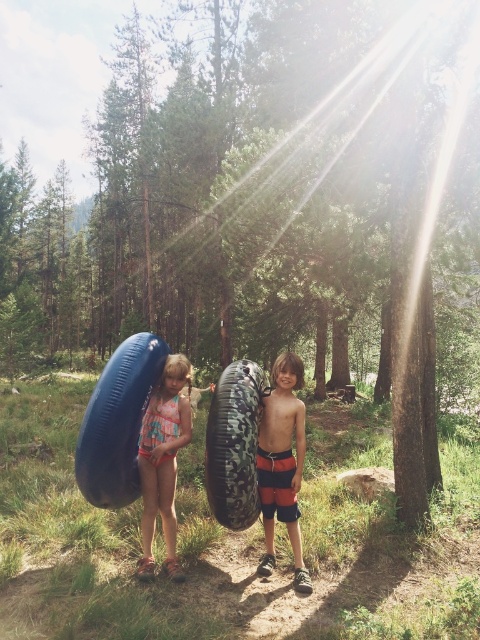
Question: Which object is closer to the camera taking this photo?

Choices:
 (A) camouflage rubber tube at center
 (B) orange striped shorts at center

Answer: (A)

Question: Observing the image, what is the correct spatial positioning of camouflage rubber tube at center in reference to orange striped shorts at center?

Choices:
 (A) below
 (B) above

Answer: (B)

Question: Based on their relative distances, which object is farther from the multicolored swimsuit at left?

Choices:
 (A) camouflage rubber tube at center
 (B) blue rubber tube at left
 (C) orange striped shorts at center

Answer: (C)

Question: Based on their relative distances, which object is nearer to the multicolored swimsuit at left?

Choices:
 (A) camouflage rubber tube at center
 (B) orange striped shorts at center
 (C) blue rubber tube at left

Answer: (C)

Question: Is camouflage rubber tube at center below orange striped shorts at center?

Choices:
 (A) no
 (B) yes

Answer: (A)

Question: Can you confirm if camouflage rubber tube at center is positioned above orange striped shorts at center?

Choices:
 (A) yes
 (B) no

Answer: (A)